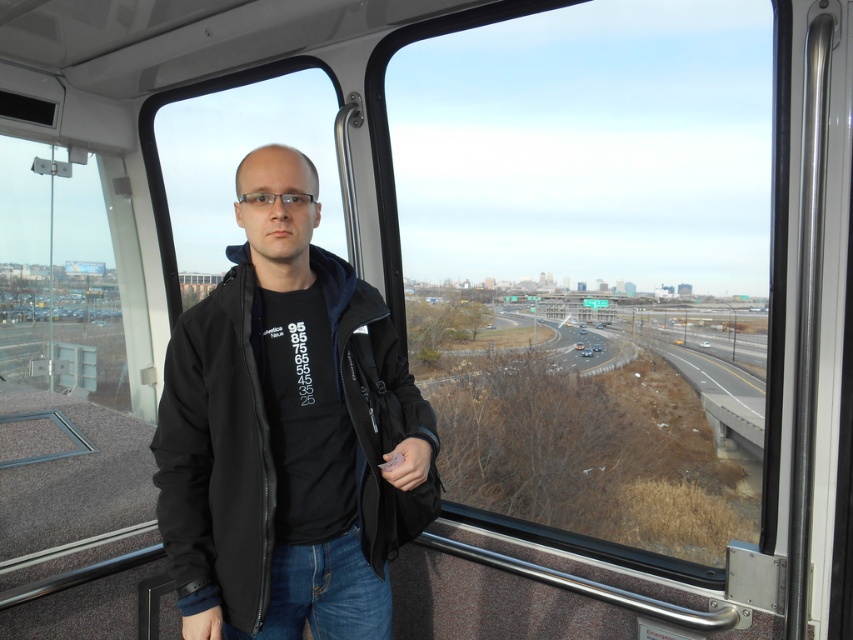
Is transparent glass window at center to the right of black softshell jacket at center from the viewer's perspective?

Correct, you'll find transparent glass window at center to the right of black softshell jacket at center.

Describe the element at coordinates (596, 260) in the screenshot. I see `transparent glass window at center` at that location.

Which is behind, point (756, 230) or point (161, 449)?

The point (756, 230) is behind.

Locate an element on the screen. transparent glass window at center is located at coordinates (596, 260).